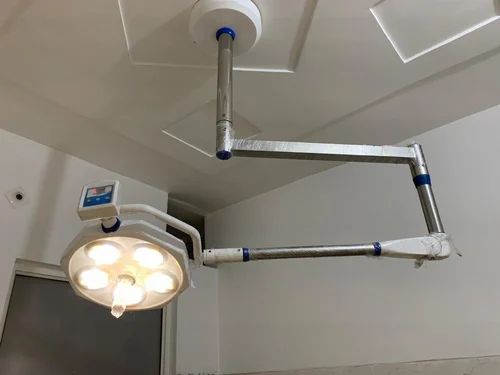
This screenshot has height=375, width=500. Identify the location of door. (84, 329).